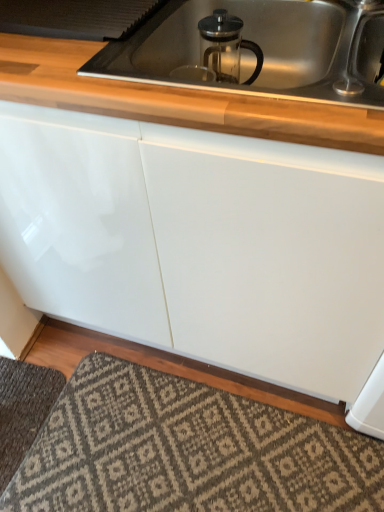
Where is `vacant region above patterned carpet at lower center, which appears as the 2th doormat when viewed from the left (from a real-world perspective)`? This screenshot has height=512, width=384. vacant region above patterned carpet at lower center, which appears as the 2th doormat when viewed from the left (from a real-world perspective) is located at coordinates (178, 451).